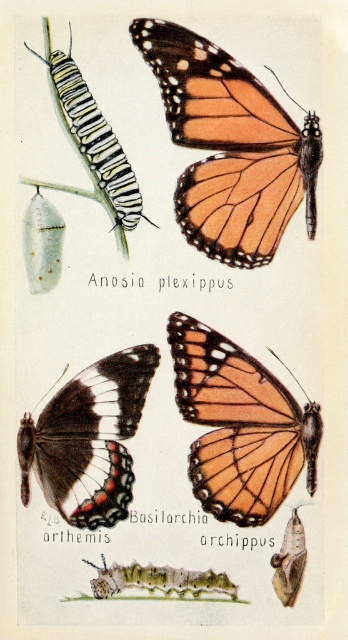
Based on the botanical illustration provided, which caterpillar is positioned higher in the image? The white striped caterpillar at upper left or the green fuzzy caterpillar at lower center?

The white striped caterpillar at upper left is positioned higher in the image than the green fuzzy caterpillar at lower center.

You are an entomologist examining the botanical illustration. You notice the orange matte butterfly at center and the green fuzzy caterpillar at lower center. Based on their positions in the illustration, which one is placed higher up?

The orange matte butterfly at center is located above the green fuzzy caterpillar at lower center, so it is placed higher up in the illustration.

You are an entomologist examining the illustration. You need to determine if the orange matte butterfly at center can fully extend its wings without overlapping the green fuzzy caterpillar at lower center. Based on their sizes, what do you conclude?

→ The orange matte butterfly at center might be wider than green fuzzy caterpillar at lower center, so there is a possibility that its wings could overlap the caterpillar when fully extended.